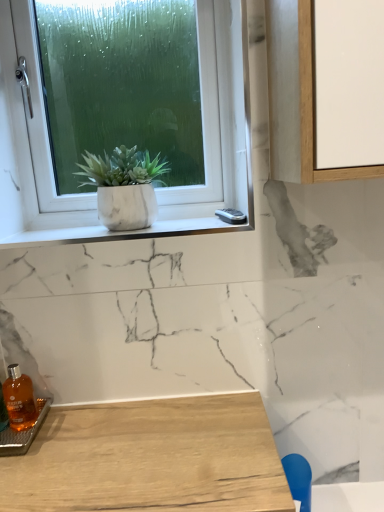
Question: From a real-world perspective, is white marble pot at upper left beneath translucent amber glass bottle at lower left?

Choices:
 (A) yes
 (B) no

Answer: (B)

Question: Does white marble pot at upper left have a lesser height compared to translucent amber glass bottle at lower left?

Choices:
 (A) no
 (B) yes

Answer: (A)

Question: From the image's perspective, is white marble pot at upper left under translucent amber glass bottle at lower left?

Choices:
 (A) yes
 (B) no

Answer: (B)

Question: Is white marble pot at upper left beside translucent amber glass bottle at lower left?

Choices:
 (A) yes
 (B) no

Answer: (B)

Question: Is white marble pot at upper left at the right side of translucent amber glass bottle at lower left?

Choices:
 (A) no
 (B) yes

Answer: (B)

Question: Is white marble pot at upper left thinner than translucent amber glass bottle at lower left?

Choices:
 (A) no
 (B) yes

Answer: (B)

Question: Is white matte window at upper left beside translucent amber glass bottle at lower left?

Choices:
 (A) no
 (B) yes

Answer: (A)

Question: From the image's perspective, does white matte window at upper left appear higher than translucent amber glass bottle at lower left?

Choices:
 (A) yes
 (B) no

Answer: (A)

Question: Can we say white matte window at upper left lies outside translucent amber glass bottle at lower left?

Choices:
 (A) no
 (B) yes

Answer: (B)

Question: Is the position of white matte window at upper left more distant than that of translucent amber glass bottle at lower left?

Choices:
 (A) yes
 (B) no

Answer: (A)

Question: Is white matte window at upper left bigger than translucent amber glass bottle at lower left?

Choices:
 (A) no
 (B) yes

Answer: (B)

Question: From the image's perspective, is white matte window at upper left under translucent amber glass bottle at lower left?

Choices:
 (A) yes
 (B) no

Answer: (B)

Question: Are white marble window sill at upper left and blue plastic chair at lower right far apart?

Choices:
 (A) yes
 (B) no

Answer: (B)